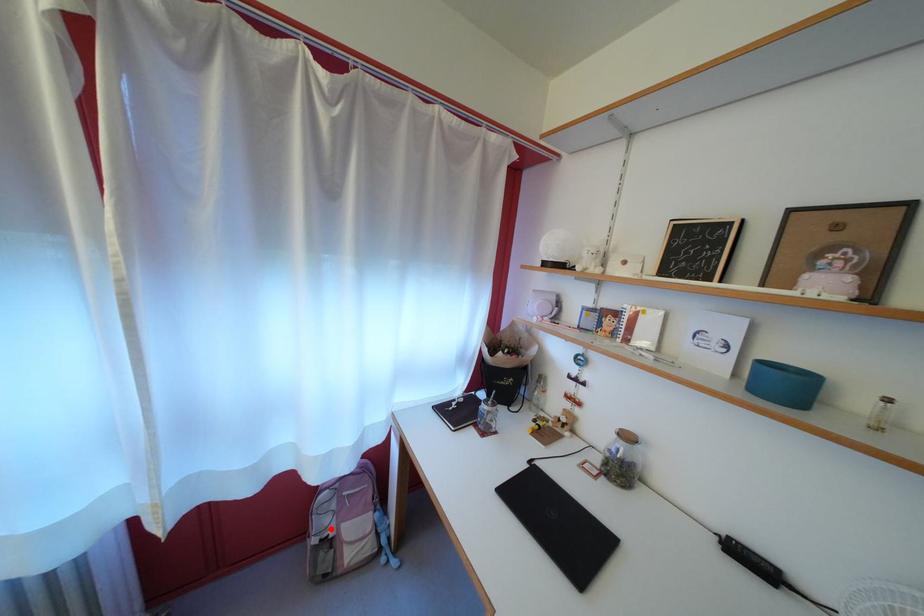
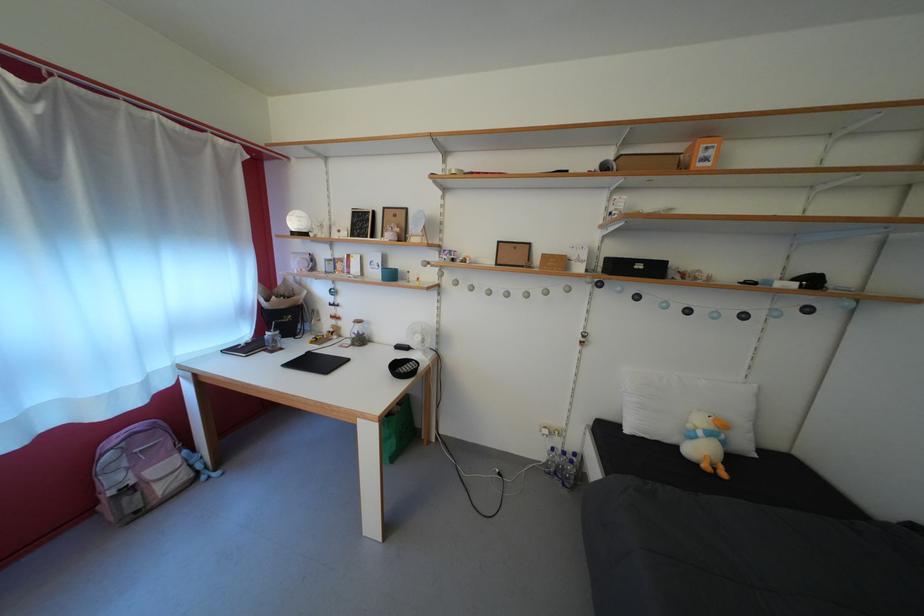
Where in the second image is the point corresponding to the highlighted location from the first image?

(123, 485)